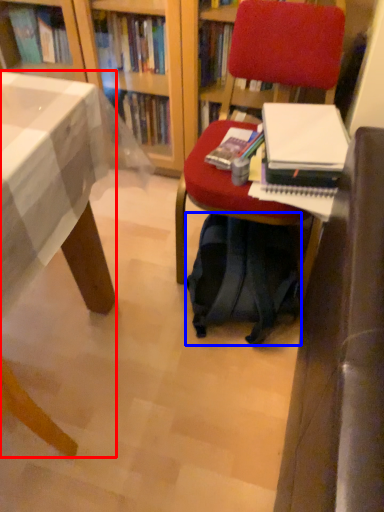
Question: Which of the following is the closest to the observer, desk (highlighted by a red box) or backpack (highlighted by a blue box)?

Choices:
 (A) desk
 (B) backpack

Answer: (A)